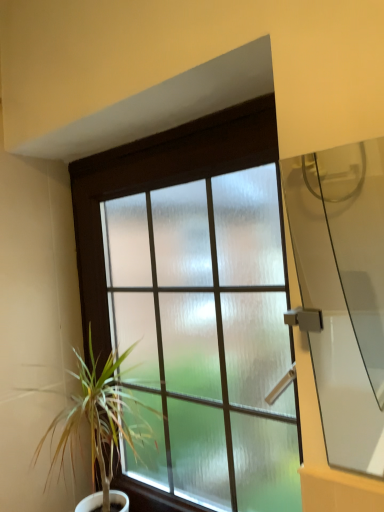
Locate an element on the screen. free point above frosted glass window at center (from a real-world perspective) is located at coordinates (163, 129).